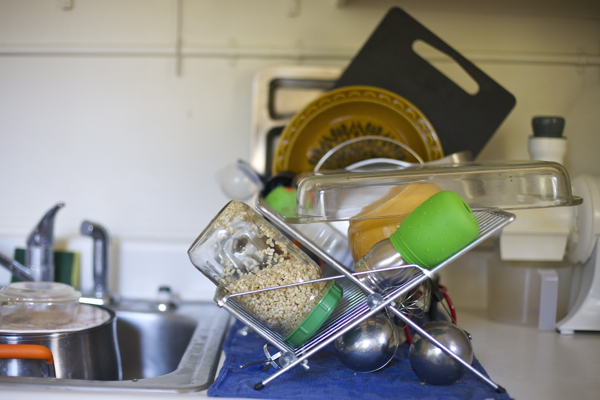
Where is `faucet handle`? This screenshot has width=600, height=400. faucet handle is located at coordinates (42, 230).